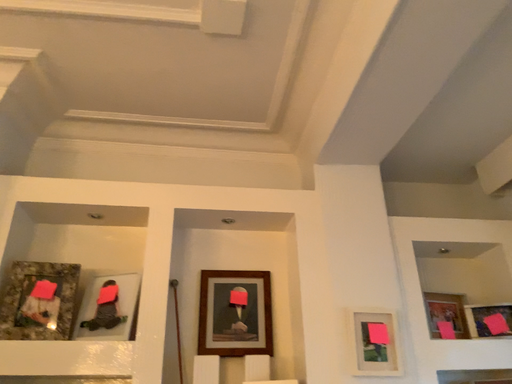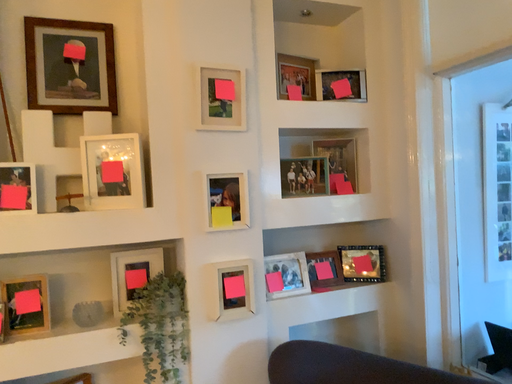
Question: Which way did the camera rotate in the video?

Choices:
 (A) rotated right
 (B) rotated left

Answer: (A)